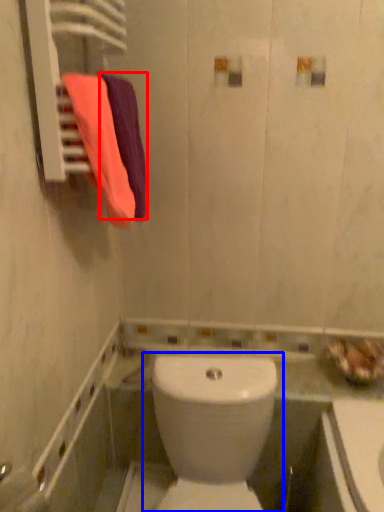
Question: Which point is closer to the camera, bath towel (highlighted by a red box) or toilet (highlighted by a blue box)?

Choices:
 (A) bath towel
 (B) toilet

Answer: (B)